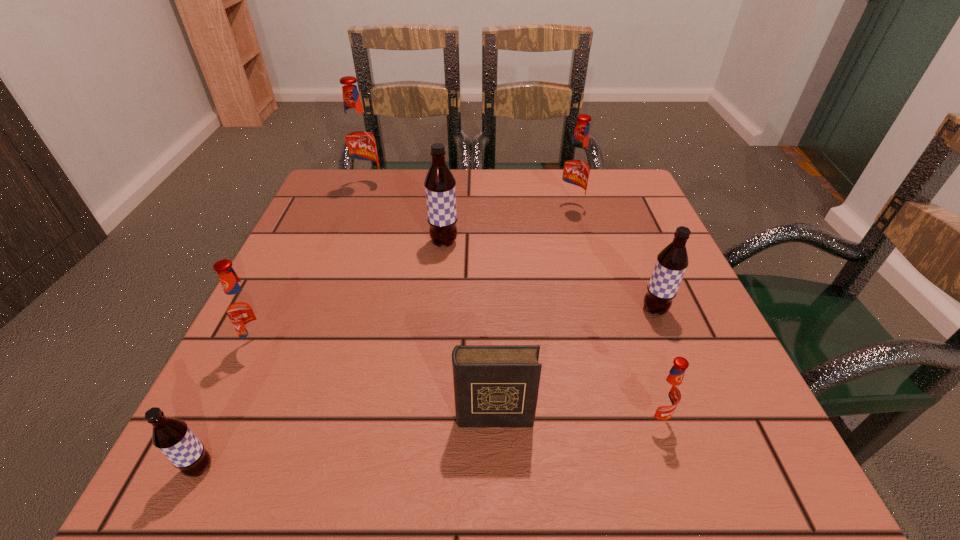
What are the coordinates of `the farthest object` in the screenshot? It's located at (359, 140).

At what (x,y) coordinates should I click in order to perform the action: click on the third object from left to right. Please return your answer as a coordinate pair (x, y). The image size is (960, 540). Looking at the image, I should click on (359, 140).

Identify the location of the sixth nearest root beer. This screenshot has width=960, height=540. (576, 167).

Image resolution: width=960 pixels, height=540 pixels. Find the location of `the third nearest red root beer`. the third nearest red root beer is located at coordinates (576, 167).

You are a GUI agent. You are given a task and a screenshot of the screen. Output one action in this format:
    pyautogui.click(x=<x>, y=<y>)
    Task: Click on the third farthest root beer
    The width and height of the screenshot is (960, 540).
    Given the screenshot: What is the action you would take?
    pyautogui.click(x=440, y=189)

Locate an element on the screen. the third farthest object is located at coordinates (440, 189).

I want to click on the rightmost brown root beer, so click(x=672, y=261).

Identify the location of the rightmost object. This screenshot has height=540, width=960. (672, 261).

Where is `the second nearest red root beer`? The width and height of the screenshot is (960, 540). the second nearest red root beer is located at coordinates (243, 308).

Where is `the third nearest root beer`? This screenshot has width=960, height=540. the third nearest root beer is located at coordinates (243, 308).